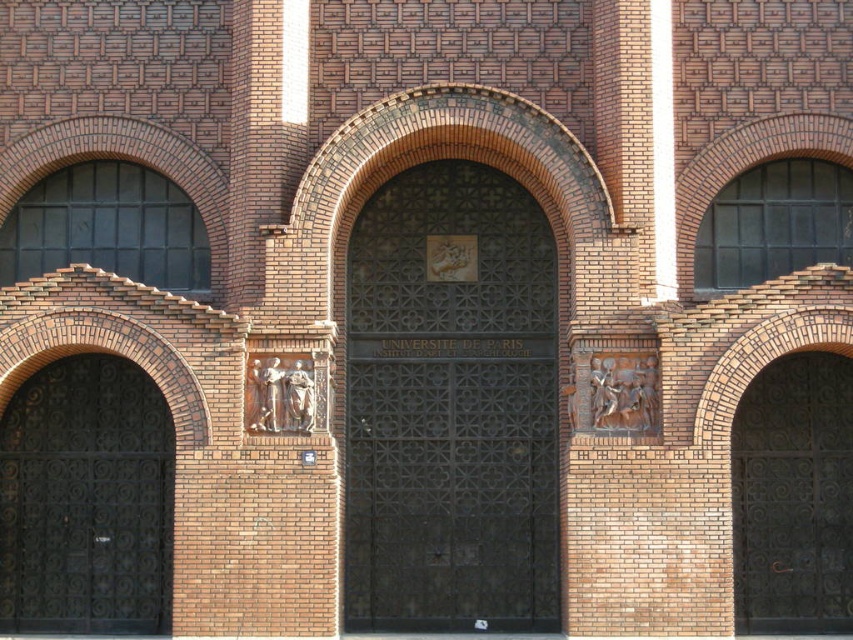
Question: Which point is closer to the camera?

Choices:
 (A) (822, 552)
 (B) (62, 480)

Answer: (A)

Question: Is black wrought iron gate at left wider than dark brown wrought iron gate at right?

Choices:
 (A) no
 (B) yes

Answer: (A)

Question: Which point is farther from the camera taking this photo?

Choices:
 (A) (418, 452)
 (B) (27, 577)
 (C) (764, 468)

Answer: (B)

Question: Does black wrought iron gate at left lie in front of dark brown wrought iron gate at right?

Choices:
 (A) no
 (B) yes

Answer: (A)

Question: Does dark bronze gate at center appear over black wrought iron gate at left?

Choices:
 (A) no
 (B) yes

Answer: (B)

Question: Which of the following is the closest to the observer?

Choices:
 (A) dark bronze gate at center
 (B) black wrought iron gate at left
 (C) dark brown wrought iron gate at right

Answer: (A)